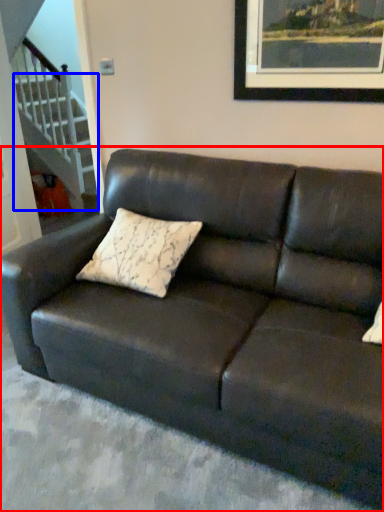
Question: Which point is further to the camera, studio couch (highlighted by a red box) or stairwell (highlighted by a blue box)?

Choices:
 (A) studio couch
 (B) stairwell

Answer: (B)